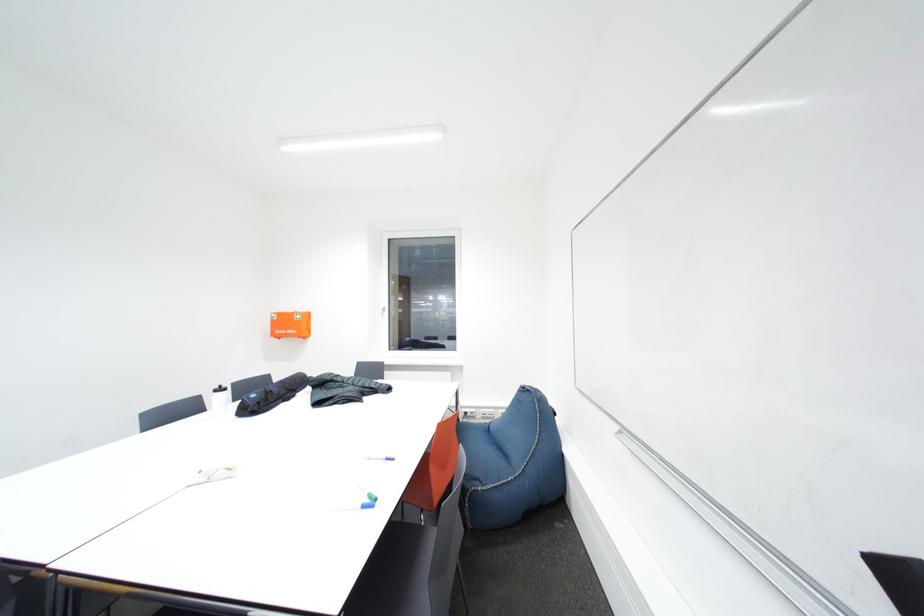
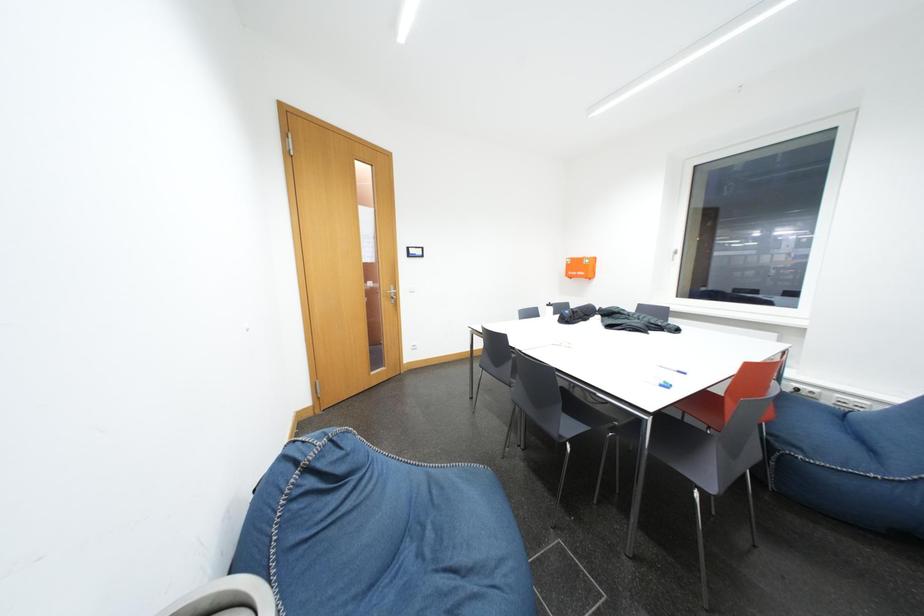
Question: How did the camera likely rotate?

Choices:
 (A) Left
 (B) Right
 (C) Up
 (D) Down

Answer: (A)